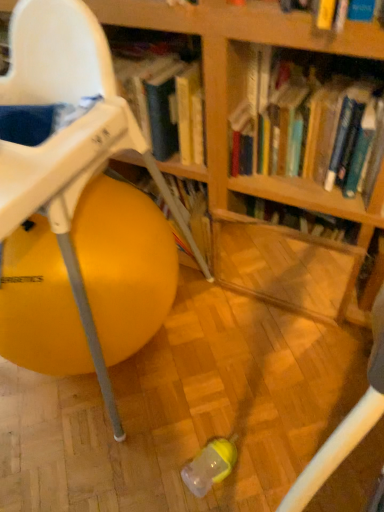
The width and height of the screenshot is (384, 512). Find the location of `vacant area to the right of yellow rubber ball at left`. vacant area to the right of yellow rubber ball at left is located at coordinates click(x=259, y=361).